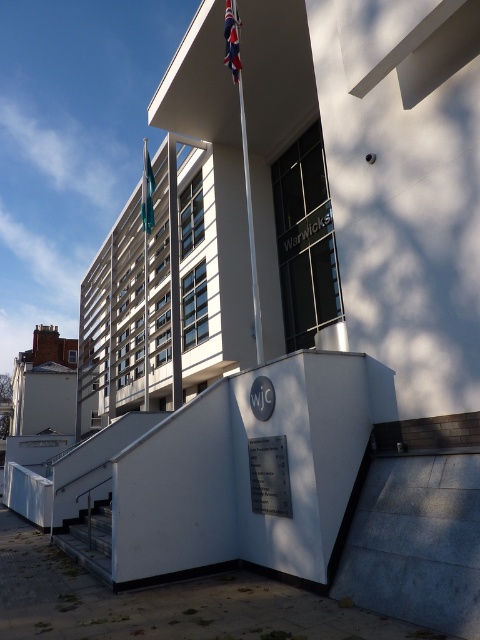
Is point (93, 556) positioned behind point (229, 45)?

That is False.

Is metallic gray staircase at lower left smaller than union jack fabric flag at upper center?

Actually, metallic gray staircase at lower left might be larger than union jack fabric flag at upper center.

Does point (90, 518) come in front of point (237, 76)?

Yes, point (90, 518) is in front of point (237, 76).

Where is `metallic gray staircase at lower left`? The width and height of the screenshot is (480, 640). metallic gray staircase at lower left is located at coordinates (90, 540).

Who is taller, metallic gray staircase at lower left or metallic flag pole at center?

With more height is metallic flag pole at center.

Is metallic gray staircase at lower left to the right of metallic flag pole at center from the viewer's perspective?

Correct, you'll find metallic gray staircase at lower left to the right of metallic flag pole at center.

Is point (96, 548) positioned behind point (152, 182)?

No, it is not.

The width and height of the screenshot is (480, 640). I want to click on metallic gray staircase at lower left, so click(x=90, y=540).

Between union jack fabric flag at upper center and blue fabric flag at upper left, which one has more height?

blue fabric flag at upper left is taller.

Measure the distance between union jack fabric flag at upper center and camera.

union jack fabric flag at upper center and camera are 29.80 feet apart.

Find the location of a particular element. union jack fabric flag at upper center is located at coordinates (231, 40).